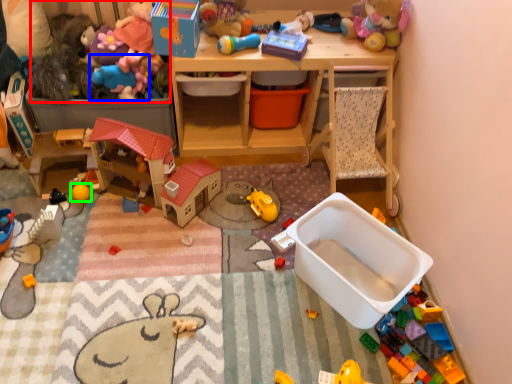
Question: Which object is the closest to the toy (highlighted by a red box)? Choose among these: toy (highlighted by a blue box) or toy (highlighted by a green box).

Choices:
 (A) toy
 (B) toy

Answer: (A)